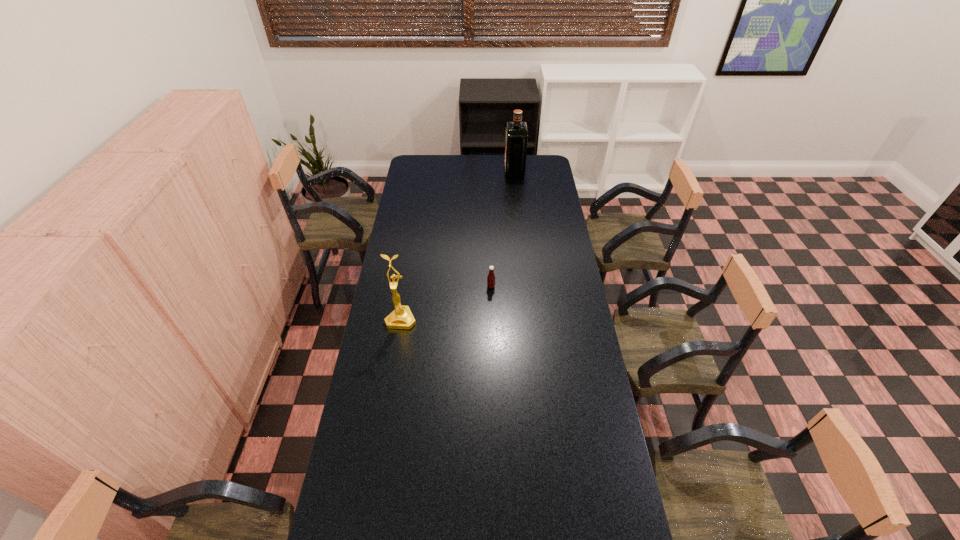
Locate an element on the screen. object that ranks as the closest to the shortest object is located at coordinates (401, 318).

The image size is (960, 540). I want to click on the second closest object to the liquor, so tap(401, 318).

The image size is (960, 540). Identify the location of free space that satisfies the following two spatial constraints: 1. on the front label of the liquor; 2. on the front-facing side of the award. (530, 319).

Where is `blank space that satisfies the following two spatial constraints: 1. on the front label of the rightmost object; 2. on the front-facing side of the leftmost object`? Image resolution: width=960 pixels, height=540 pixels. blank space that satisfies the following two spatial constraints: 1. on the front label of the rightmost object; 2. on the front-facing side of the leftmost object is located at coordinates (530, 319).

The height and width of the screenshot is (540, 960). In order to click on vacant space that satisfies the following two spatial constraints: 1. on the front label of the rightmost object; 2. on the front side of the Tabasco sauce in this screenshot , I will do `click(526, 287)`.